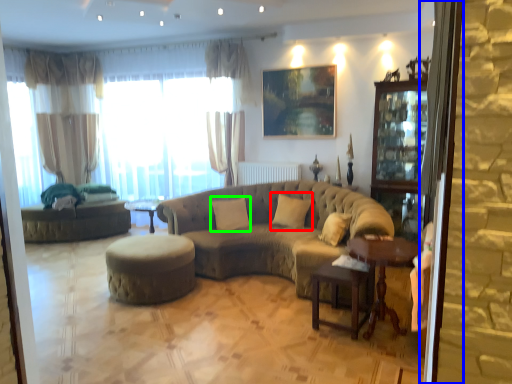
Question: Which object is the farthest from pillow (highlighted by a red box)? Choose among these: screen door (highlighted by a blue box) or pillow (highlighted by a green box).

Choices:
 (A) screen door
 (B) pillow

Answer: (A)